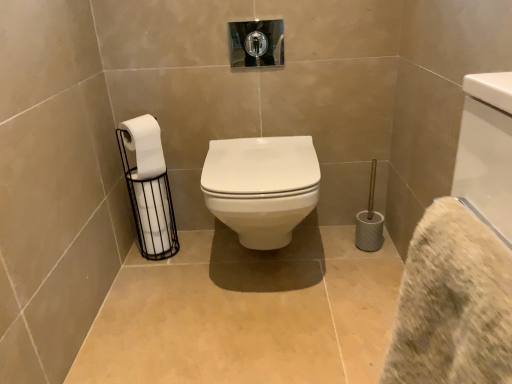
What do you see at coordinates (144, 145) in the screenshot?
I see `white matte toilet paper at left, which is the 1th toilet paper in top-to-bottom order` at bounding box center [144, 145].

Describe the element at coordinates (453, 302) in the screenshot. I see `beige textured bath towel at lower right` at that location.

Where is `white matte toilet paper at left, the second toilet paper in the bottom-to-top sequence`? The image size is (512, 384). white matte toilet paper at left, the second toilet paper in the bottom-to-top sequence is located at coordinates (144, 145).

Can you confirm if white matte toilet paper at left, which is the 1th toilet paper in top-to-bottom order, is positioned to the left of white glossy toilet at center?

Yes, white matte toilet paper at left, which is the 1th toilet paper in top-to-bottom order, is to the left of white glossy toilet at center.

Considering the relative sizes of white matte toilet paper at left, which is the 1th toilet paper in top-to-bottom order, and white glossy toilet at center in the image provided, is white matte toilet paper at left, which is the 1th toilet paper in top-to-bottom order, taller than white glossy toilet at center?

Incorrect, the height of white matte toilet paper at left, which is the 1th toilet paper in top-to-bottom order, is not larger of that of white glossy toilet at center.

Find the location of a particular element. Image resolution: width=512 pixels, height=384 pixels. toilet that is below the white matte toilet paper at left, the second toilet paper in the bottom-to-top sequence (from the image's perspective) is located at coordinates (261, 186).

Is white matte toilet paper at left, the second toilet paper in the bottom-to-top sequence, directly adjacent to white glossy toilet at center?

white matte toilet paper at left, the second toilet paper in the bottom-to-top sequence, and white glossy toilet at center are not in contact.

Measure the distance from beige textured bath towel at lower right to white matte toilet paper at left, which is the 2th toilet paper in top-to-bottom order.

A distance of 1.24 meters exists between beige textured bath towel at lower right and white matte toilet paper at left, which is the 2th toilet paper in top-to-bottom order.

Is beige textured bath towel at lower right next to white matte toilet paper at left, which is the 2th toilet paper in top-to-bottom order, and touching it?

No, beige textured bath towel at lower right is not touching white matte toilet paper at left, which is the 2th toilet paper in top-to-bottom order.

Would you say beige textured bath towel at lower right is to the left or to the right of white matte toilet paper at left, which is the 2th toilet paper in top-to-bottom order, in the picture?

Based on their positions, beige textured bath towel at lower right is located to the right of white matte toilet paper at left, which is the 2th toilet paper in top-to-bottom order.

Find the location of a particular element. The width and height of the screenshot is (512, 384). bath towel in front of the white matte toilet paper at left, which is the 2th toilet paper in top-to-bottom order is located at coordinates (453, 302).

Considering the positions of points (285, 243) and (148, 251), is point (285, 243) closer to camera compared to point (148, 251)?

Yes, it is.

Would you say white glossy toilet at center is outside white matte toilet paper at left, which is the 2th toilet paper in top-to-bottom order?

Yes, white glossy toilet at center is not within white matte toilet paper at left, which is the 2th toilet paper in top-to-bottom order.

Locate an element on the screen. The image size is (512, 384). toilet lying in front of the white matte toilet paper at left, which is the 1th toilet paper from bottom to top is located at coordinates (261, 186).

From a real-world perspective, is white glossy toilet at center located beneath white matte toilet paper at left, which is the 1th toilet paper in top-to-bottom order?

Correct, in the physical world, white glossy toilet at center is lower than white matte toilet paper at left, which is the 1th toilet paper in top-to-bottom order.

Which object is positioned more to the right, white glossy toilet at center or white matte toilet paper at left, the second toilet paper in the bottom-to-top sequence?

white glossy toilet at center.

Does white glossy toilet at center turn towards white matte toilet paper at left, the second toilet paper in the bottom-to-top sequence?

No, white glossy toilet at center does not turn towards white matte toilet paper at left, the second toilet paper in the bottom-to-top sequence.

Consider the image. From the image's perspective, between white glossy toilet at center and beige textured bath towel at lower right, which one is located above?

From the image's view, white glossy toilet at center is above.

Between white glossy toilet at center and beige textured bath towel at lower right, which one is positioned behind?

Positioned behind is white glossy toilet at center.

How much distance is there between white glossy toilet at center and beige textured bath towel at lower right?

A distance of 34.19 inches exists between white glossy toilet at center and beige textured bath towel at lower right.

From a real-world perspective, between white glossy toilet at center and beige textured bath towel at lower right, who is vertically higher?

From a 3D spatial view, beige textured bath towel at lower right is above.

Considering the relative positions of white matte toilet paper at left, which is the 1th toilet paper in top-to-bottom order, and white matte toilet paper at left, which is the 2th toilet paper in top-to-bottom order, in the image provided, is white matte toilet paper at left, which is the 1th toilet paper in top-to-bottom order, to the right of white matte toilet paper at left, which is the 2th toilet paper in top-to-bottom order, from the viewer's perspective?

In fact, white matte toilet paper at left, which is the 1th toilet paper in top-to-bottom order, is to the left of white matte toilet paper at left, which is the 2th toilet paper in top-to-bottom order.

Considering the sizes of white matte toilet paper at left, which is the 1th toilet paper in top-to-bottom order, and white matte toilet paper at left, which is the 1th toilet paper from bottom to top, in the image, is white matte toilet paper at left, which is the 1th toilet paper in top-to-bottom order, taller or shorter than white matte toilet paper at left, which is the 1th toilet paper from bottom to top,?

Considering their sizes, white matte toilet paper at left, which is the 1th toilet paper in top-to-bottom order, has less height than white matte toilet paper at left, which is the 1th toilet paper from bottom to top.

Does point (146, 120) appear closer or farther from the camera than point (162, 233)?

Point (146, 120) is closer to the camera than point (162, 233).

Considering the relative positions of white matte toilet paper at left, which is the 1th toilet paper from bottom to top, and white glossy toilet at center in the image provided, is white matte toilet paper at left, which is the 1th toilet paper from bottom to top, to the left or to the right of white glossy toilet at center?

Based on their positions, white matte toilet paper at left, which is the 1th toilet paper from bottom to top, is located to the left of white glossy toilet at center.

Does point (149, 195) appear closer or farther from the camera than point (277, 242)?

Point (149, 195).

In the scene shown: How far apart are white matte toilet paper at left, which is the 1th toilet paper from bottom to top, and white glossy toilet at center?

15.11 inches.

At what (x,y) coordinates should I click in order to perform the action: click on toilet that appears on the right of white matte toilet paper at left, the second toilet paper in the bottom-to-top sequence. Please return your answer as a coordinate pair (x, y). Looking at the image, I should click on (261, 186).

Image resolution: width=512 pixels, height=384 pixels. I want to click on the 1st toilet paper to the left of the beige textured bath towel at lower right, counting from the anchor's position, so click(x=148, y=187).

Based on their spatial positions, is white glossy toilet at center or beige textured bath towel at lower right closer to white matte toilet paper at left, which is the 1th toilet paper in top-to-bottom order?

Among the two, white glossy toilet at center is located nearer to white matte toilet paper at left, which is the 1th toilet paper in top-to-bottom order.

Looking at the image, which one is located further to white matte toilet paper at left, which is the 1th toilet paper from bottom to top, white glossy toilet at center or beige textured bath towel at lower right?

Based on the image, beige textured bath towel at lower right appears to be further to white matte toilet paper at left, which is the 1th toilet paper from bottom to top.

Which object lies nearer to the anchor point beige textured bath towel at lower right, white matte toilet paper at left, which is the 1th toilet paper from bottom to top, or white matte toilet paper at left, the second toilet paper in the bottom-to-top sequence?

white matte toilet paper at left, the second toilet paper in the bottom-to-top sequence, is positioned closer to the anchor beige textured bath towel at lower right.

Based on their spatial positions, is beige textured bath towel at lower right or white matte toilet paper at left, which is the 1th toilet paper in top-to-bottom order, further from white matte toilet paper at left, which is the 1th toilet paper from bottom to top?

beige textured bath towel at lower right.

From the image, which object appears to be nearer to white glossy toilet at center, white matte toilet paper at left, which is the 1th toilet paper from bottom to top, or white matte toilet paper at left, which is the 1th toilet paper in top-to-bottom order?

The object closer to white glossy toilet at center is white matte toilet paper at left, which is the 1th toilet paper from bottom to top.

When comparing their distances from white matte toilet paper at left, which is the 1th toilet paper in top-to-bottom order, does white matte toilet paper at left, which is the 2th toilet paper in top-to-bottom order, or beige textured bath towel at lower right seem closer?

white matte toilet paper at left, which is the 2th toilet paper in top-to-bottom order, lies closer to white matte toilet paper at left, which is the 1th toilet paper in top-to-bottom order, than the other object.

When comparing their distances from white glossy toilet at center, does white matte toilet paper at left, which is the 1th toilet paper in top-to-bottom order, or white matte toilet paper at left, which is the 1th toilet paper from bottom to top, seem further?

Based on the image, white matte toilet paper at left, which is the 1th toilet paper in top-to-bottom order, appears to be further to white glossy toilet at center.

Based on their spatial positions, is white glossy toilet at center or white matte toilet paper at left, which is the 2th toilet paper in top-to-bottom order, further from white matte toilet paper at left, the second toilet paper in the bottom-to-top sequence?

white glossy toilet at center is further to white matte toilet paper at left, the second toilet paper in the bottom-to-top sequence.

Identify the location of toilet paper situated between white matte toilet paper at left, the second toilet paper in the bottom-to-top sequence, and white glossy toilet at center from left to right. [148, 187].

I want to click on toilet between beige textured bath towel at lower right and white matte toilet paper at left, which is the 1th toilet paper in top-to-bottom order, along the z-axis, so click(261, 186).

Locate an element on the screen. The image size is (512, 384). toilet located between beige textured bath towel at lower right and white matte toilet paper at left, which is the 2th toilet paper in top-to-bottom order, in the depth direction is located at coordinates (261, 186).

Find the location of a particular element. toilet paper between beige textured bath towel at lower right and white matte toilet paper at left, which is the 2th toilet paper in top-to-bottom order, along the z-axis is located at coordinates (144, 145).